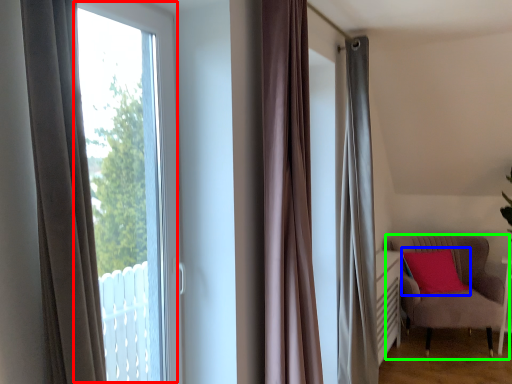
Question: Which object is the farthest from bay window (highlighted by a red box)? Choose among these: pillow (highlighted by a blue box) or chair (highlighted by a green box).

Choices:
 (A) pillow
 (B) chair

Answer: (B)